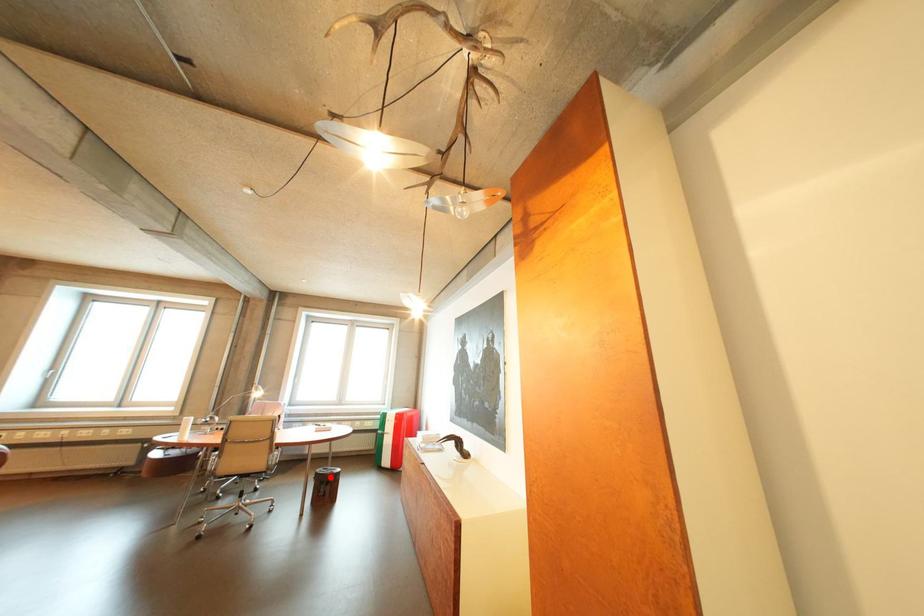
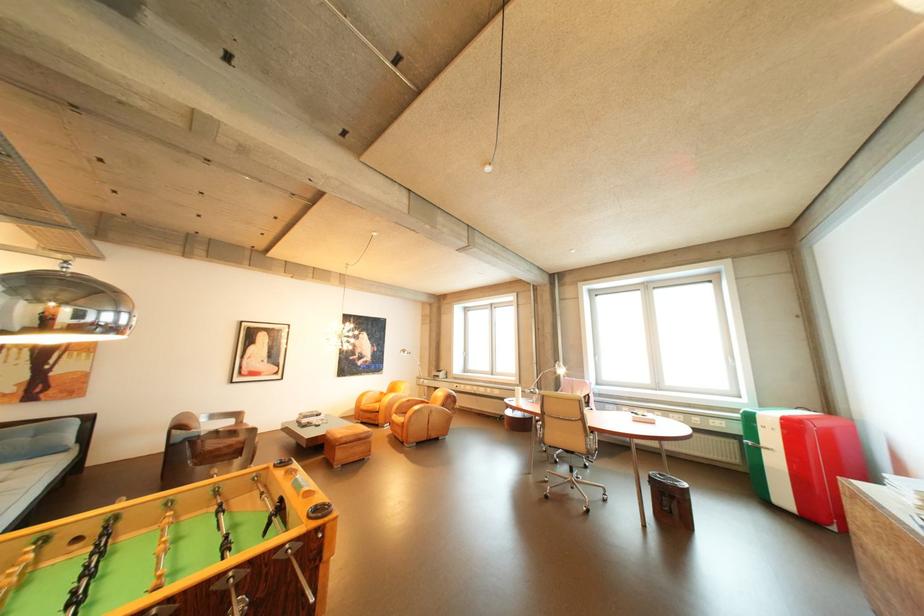
In the second image, find the point that corresponds to the highlighted location in the first image.

(666, 483)